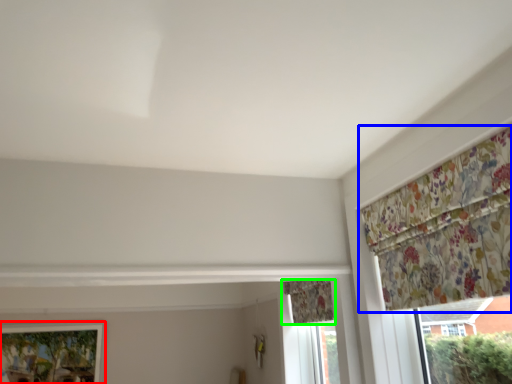
Question: Estimate the real-world distances between objects in this image. Which object is closer to window (highlighted by a red box), curtain (highlighted by a blue box) or curtain (highlighted by a green box)?

Choices:
 (A) curtain
 (B) curtain

Answer: (B)